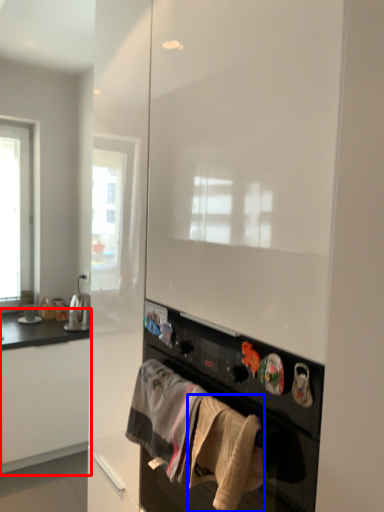
Question: Among these objects, which one is farthest to the camera, cabinetry (highlighted by a red box) or clothing (highlighted by a blue box)?

Choices:
 (A) cabinetry
 (B) clothing

Answer: (A)